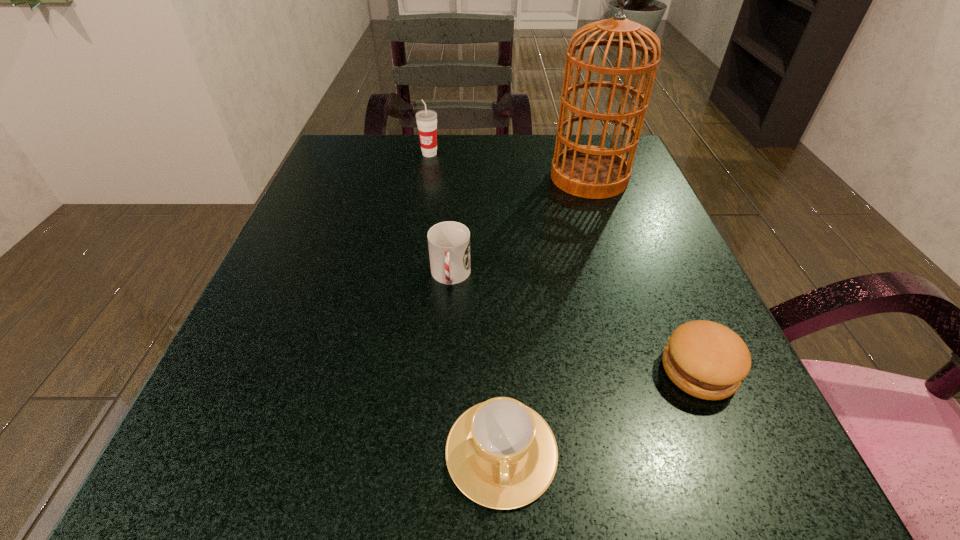
Find the location of a particular element. free point between the second shortest cup and the farthest cup is located at coordinates (440, 215).

Where is `free spot between the nearest cup and the tallest object`? The width and height of the screenshot is (960, 540). free spot between the nearest cup and the tallest object is located at coordinates (545, 314).

Where is `unoccupied position between the second shortest cup and the hamburger`? The width and height of the screenshot is (960, 540). unoccupied position between the second shortest cup and the hamburger is located at coordinates (575, 323).

Where is `object that is the fourth closest to the second tallest cup`? This screenshot has width=960, height=540. object that is the fourth closest to the second tallest cup is located at coordinates (426, 120).

Image resolution: width=960 pixels, height=540 pixels. What are the coordinates of `object that ranks as the fourth closest to the birdcage` in the screenshot? It's located at (501, 454).

Identify the location of cup object that ranks as the second closest to the third farthest object. (426, 120).

Identify which cup is the nearest to the nearest cup. Please provide its 2D coordinates. Your answer should be formatted as a tuple, i.e. [(x, y)], where the tuple contains the x and y coordinates of a point satisfying the conditions above.

[(449, 242)]

Where is `vacant area that satisfies the following two spatial constraints: 1. on the side of the second tallest cup where the handle is located; 2. on the left side of the hamburger`? vacant area that satisfies the following two spatial constraints: 1. on the side of the second tallest cup where the handle is located; 2. on the left side of the hamburger is located at coordinates (444, 370).

I want to click on vacant space that satisfies the following two spatial constraints: 1. on the side of the leftmost cup with the logo; 2. on the left side of the hamburger, so click(x=394, y=370).

The height and width of the screenshot is (540, 960). I want to click on vacant region that satisfies the following two spatial constraints: 1. on the side of the farthest cup with the logo; 2. on the left side of the hamburger, so click(x=394, y=370).